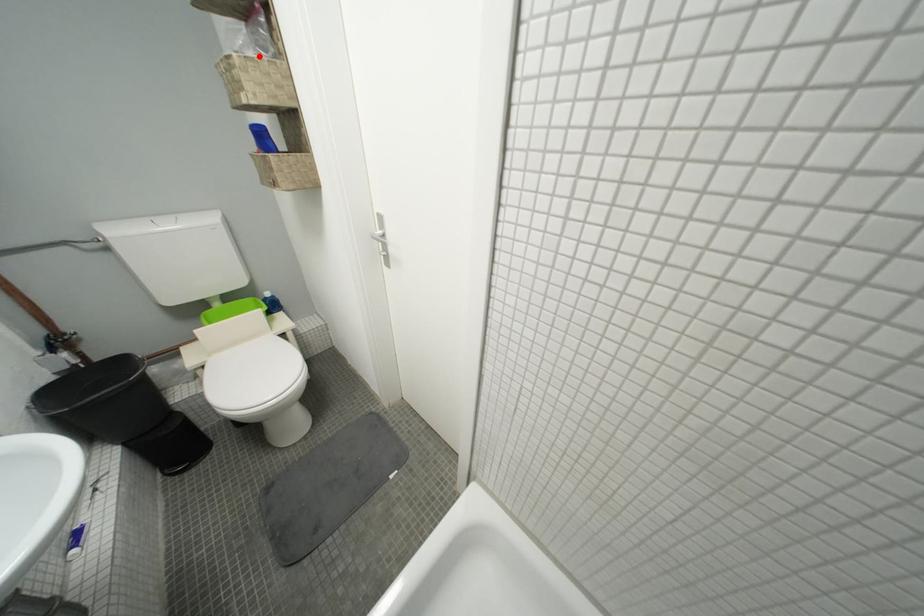
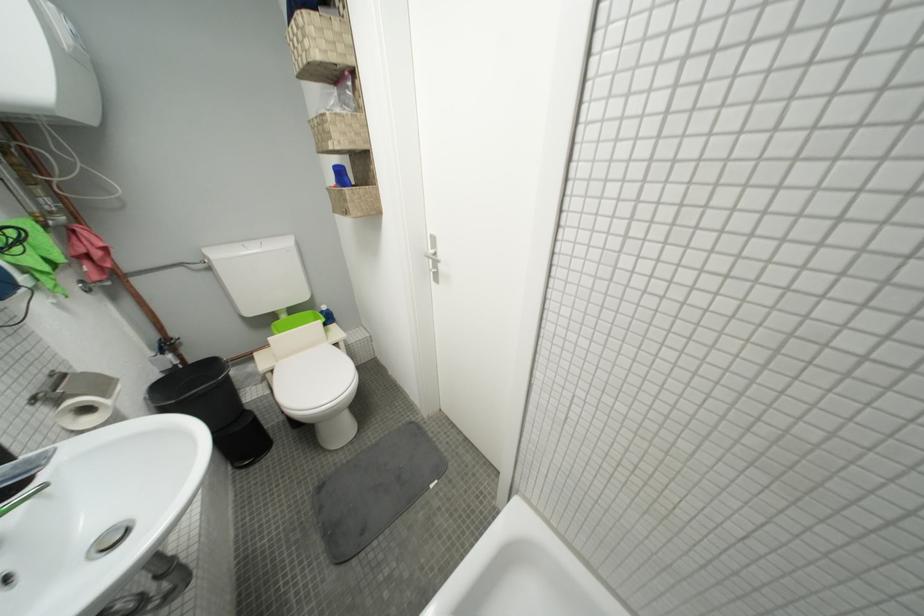
In the second image, find the point that corresponds to the highlighted location in the first image.

(346, 113)